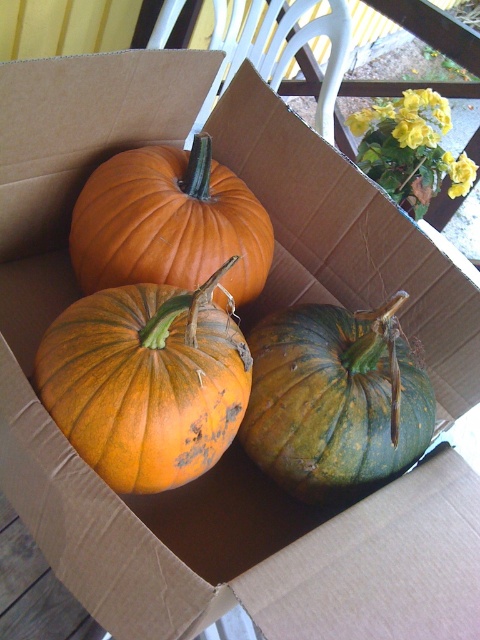
You are standing in front of a cardboard box containing three pumpkins. You see a point marked at coordinates (335, 400). Which pumpkin is located at that point?

The point at (335, 400) indicates the green matte pumpkin at center.

You are standing in front of the cardboard box and want to place a decorative ribbon exactly at the center point of the orange matte pumpkin at center. According to the image, what are the coordinates where you should place the ribbon?

The coordinates for the center point of the orange matte pumpkin at center are at point (145, 381).